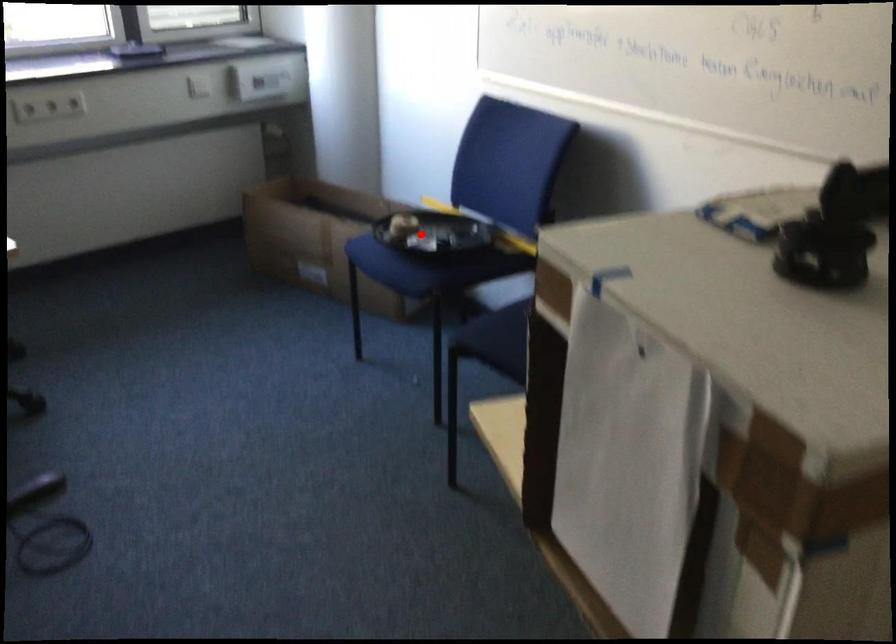
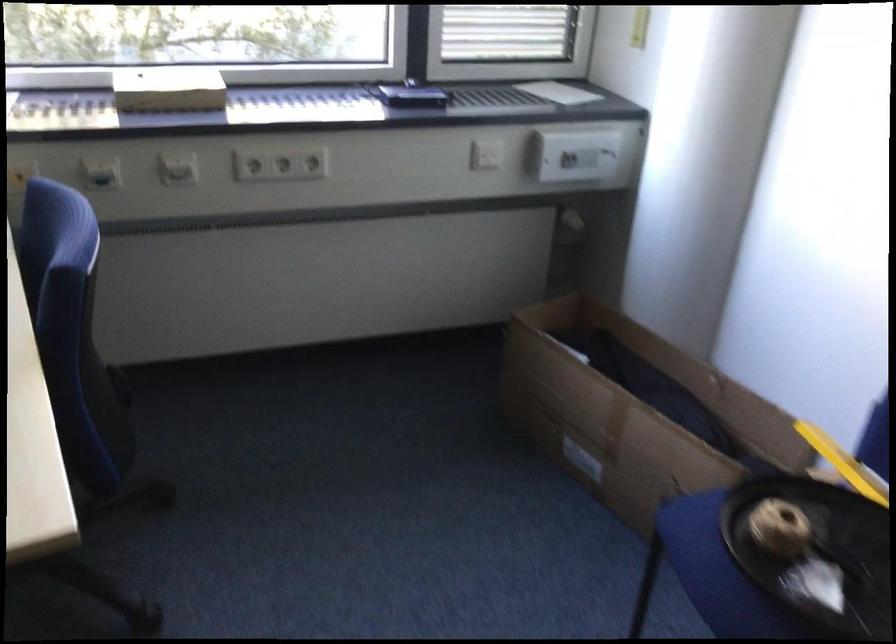
Question: I am providing you with two images of the same scene from different viewpoints. In image1, a red point is highlighted. Considering the same 3D point in image2, which of the following is correct?

Choices:
 (A) It is closer
 (B) It is farther

Answer: (A)